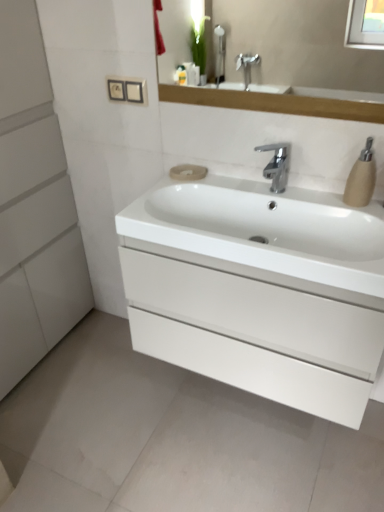
Question: From the image's perspective, is beige matte soap at center over white glossy sink at center?

Choices:
 (A) no
 (B) yes

Answer: (B)

Question: From a real-world perspective, is beige matte soap at center beneath white glossy sink at center?

Choices:
 (A) no
 (B) yes

Answer: (A)

Question: Is beige matte soap at center shorter than white glossy sink at center?

Choices:
 (A) yes
 (B) no

Answer: (A)

Question: Is beige matte soap at center at the left side of white glossy sink at center?

Choices:
 (A) no
 (B) yes

Answer: (B)

Question: From a real-world perspective, does beige matte soap at center stand above white glossy sink at center?

Choices:
 (A) no
 (B) yes

Answer: (B)

Question: Based on their positions, is beige matte soap at center located to the left or right of beige matte soap dispenser at right?

Choices:
 (A) right
 (B) left

Answer: (B)

Question: From the image's perspective, is beige matte soap at center located above or below beige matte soap dispenser at right?

Choices:
 (A) below
 (B) above

Answer: (B)

Question: Is beige matte soap at center bigger or smaller than beige matte soap dispenser at right?

Choices:
 (A) small
 (B) big

Answer: (A)

Question: In terms of width, does beige matte soap at center look wider or thinner when compared to beige matte soap dispenser at right?

Choices:
 (A) wide
 (B) thin

Answer: (A)

Question: From a real-world perspective, is white matte cabinet at left above or below white glossy sink at center?

Choices:
 (A) above
 (B) below

Answer: (B)

Question: Based on their positions, is white matte cabinet at left located to the left or right of white glossy sink at center?

Choices:
 (A) right
 (B) left

Answer: (B)

Question: Is white matte cabinet at left situated inside white glossy sink at center or outside?

Choices:
 (A) inside
 (B) outside

Answer: (B)

Question: Considering the positions of white matte cabinet at left and white glossy sink at center in the image, is white matte cabinet at left taller or shorter than white glossy sink at center?

Choices:
 (A) tall
 (B) short

Answer: (A)

Question: In terms of width, does beige matte soap dispenser at right look wider or thinner when compared to white glossy drawer at center?

Choices:
 (A) thin
 (B) wide

Answer: (A)

Question: From their relative heights in the image, would you say beige matte soap dispenser at right is taller or shorter than white glossy drawer at center?

Choices:
 (A) short
 (B) tall

Answer: (A)